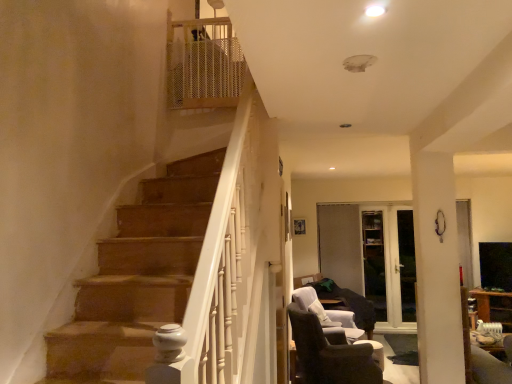
Question: Considering the relative positions of white glossy ceiling light at upper center and dark brown fabric chair at lower right, the first chair in the front-to-back sequence, in the image provided, is white glossy ceiling light at upper center to the left or to the right of dark brown fabric chair at lower right, the first chair in the front-to-back sequence,?

Choices:
 (A) left
 (B) right

Answer: (A)

Question: From a real-world perspective, relative to dark brown fabric chair at lower right, the first chair in the front-to-back sequence, is white glossy ceiling light at upper center vertically above or below?

Choices:
 (A) above
 (B) below

Answer: (A)

Question: Estimate the real-world distances between objects in this image. Which object is farther from the dark brown fabric chair at lower right, the first chair in the front-to-back sequence?

Choices:
 (A) transparent glass door at center, which is the first glass door from left to right
 (B) transparent glass door at center, which ranks as the second glass door in left-to-right order
 (C) dark brown fabric chair at lower right, which appears as the 1th chair when viewed from the back
 (D) white glossy ceiling light at upper center

Answer: (D)

Question: Which object is the farthest from the transparent glass door at center, which ranks as the second glass door in left-to-right order?

Choices:
 (A) dark brown fabric chair at lower right, which is the 2th chair from back to front
 (B) dark brown fabric chair at lower right, acting as the 2th chair starting from the front
 (C) transparent glass door at center, positioned as the 2th glass door in right-to-left order
 (D) white glossy ceiling light at upper center

Answer: (D)